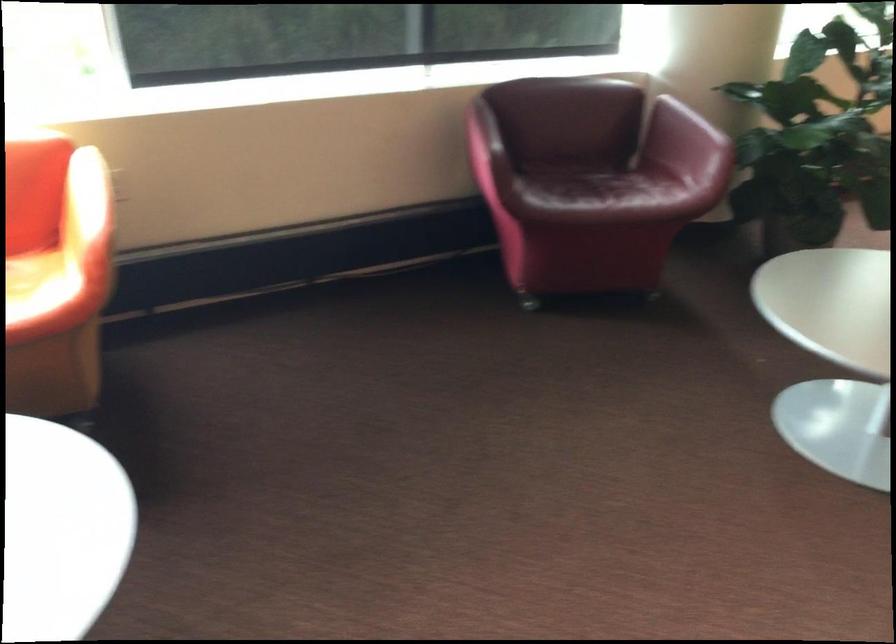
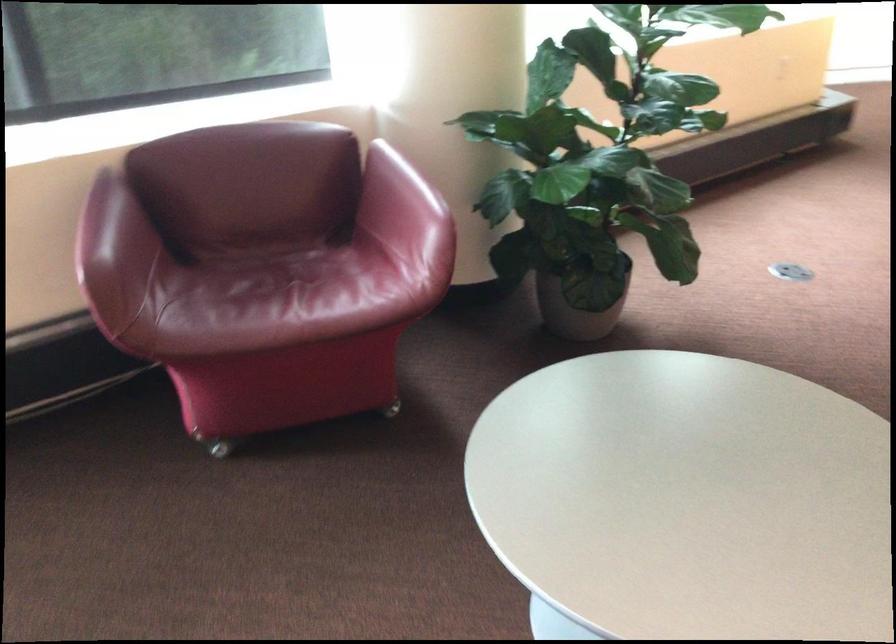
Question: The images are taken continuously from a first-person perspective. In which direction is your viewpoint rotating?

Choices:
 (A) Left
 (B) Right
 (C) Up
 (D) Down

Answer: (B)